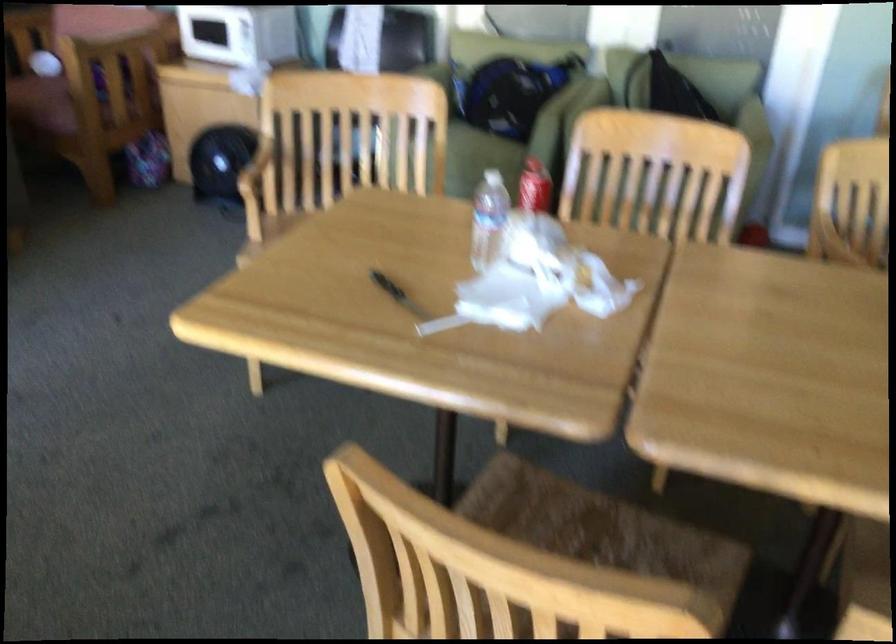
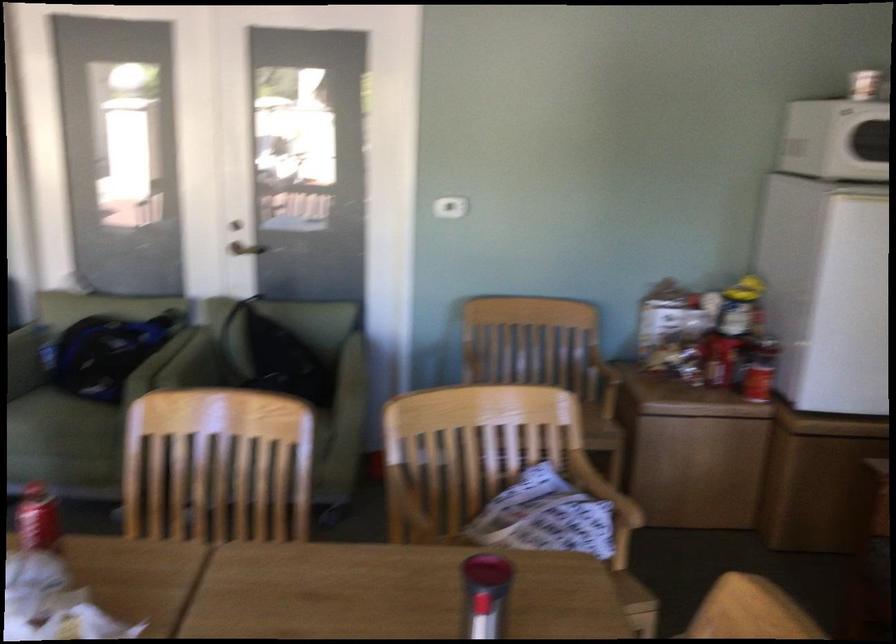
In the second image, find the point that corresponds to [757,118] in the first image.

(354, 365)